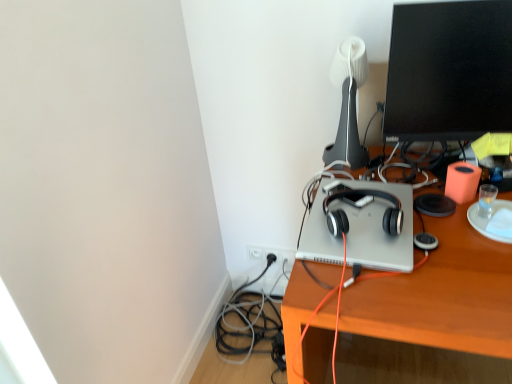
Question: Could you tell me if white matte table lamp at upper center is facing satin black headphones at center?

Choices:
 (A) no
 (B) yes

Answer: (B)

Question: From the image's perspective, would you say white matte table lamp at upper center is shown under satin black headphones at center?

Choices:
 (A) no
 (B) yes

Answer: (A)

Question: Is white matte table lamp at upper center to the left of satin black headphones at center from the viewer's perspective?

Choices:
 (A) no
 (B) yes

Answer: (A)

Question: Is white matte table lamp at upper center positioned before satin black headphones at center?

Choices:
 (A) no
 (B) yes

Answer: (A)

Question: From a real-world perspective, does white matte table lamp at upper center sit lower than satin black headphones at center?

Choices:
 (A) no
 (B) yes

Answer: (A)

Question: Based on their sizes in the image, would you say silver metallic laptop at center is bigger or smaller than black glossy monitor at upper right?

Choices:
 (A) small
 (B) big

Answer: (A)

Question: Considering the positions of silver metallic laptop at center and black glossy monitor at upper right in the image, is silver metallic laptop at center wider or thinner than black glossy monitor at upper right?

Choices:
 (A) thin
 (B) wide

Answer: (B)

Question: Is silver metallic laptop at center taller or shorter than black glossy monitor at upper right?

Choices:
 (A) tall
 (B) short

Answer: (B)

Question: From a real-world perspective, relative to black glossy monitor at upper right, is silver metallic laptop at center vertically above or below?

Choices:
 (A) above
 (B) below

Answer: (B)

Question: Considering the positions of point (443, 66) and point (323, 230), is point (443, 66) closer or farther from the camera than point (323, 230)?

Choices:
 (A) closer
 (B) farther

Answer: (B)

Question: Is black glossy monitor at upper right taller or shorter than silver metallic laptop at center?

Choices:
 (A) tall
 (B) short

Answer: (A)

Question: From the image's perspective, is black glossy monitor at upper right positioned above or below silver metallic laptop at center?

Choices:
 (A) below
 (B) above

Answer: (B)

Question: From a real-world perspective, is black glossy monitor at upper right positioned above or below silver metallic laptop at center?

Choices:
 (A) above
 (B) below

Answer: (A)

Question: In terms of width, does black glossy monitor at upper right look wider or thinner when compared to wooden desk at center?

Choices:
 (A) thin
 (B) wide

Answer: (A)

Question: Based on their sizes in the image, would you say black glossy monitor at upper right is bigger or smaller than wooden desk at center?

Choices:
 (A) big
 (B) small

Answer: (B)